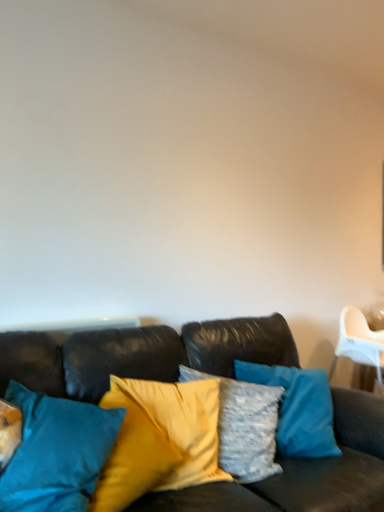
Question: Is silky yellow pillow at center, the 2th pillow when ordered from left to right, turned away from teal fabric pillow at center, marked as the 1th pillow in a left-to-right arrangement?

Choices:
 (A) yes
 (B) no

Answer: (B)

Question: Can you confirm if silky yellow pillow at center, the 2th pillow when ordered from left to right, is thinner than teal fabric pillow at center, marked as the 1th pillow in a left-to-right arrangement?

Choices:
 (A) no
 (B) yes

Answer: (B)

Question: Does silky yellow pillow at center, the 2th pillow when ordered from left to right, have a larger size compared to teal fabric pillow at center, the second pillow in the right-to-left sequence?

Choices:
 (A) yes
 (B) no

Answer: (B)

Question: From a real-world perspective, is silky yellow pillow at center, the 2th pillow when ordered from left to right, positioned under teal fabric pillow at center, the second pillow in the right-to-left sequence, based on gravity?

Choices:
 (A) yes
 (B) no

Answer: (A)

Question: Does silky yellow pillow at center, the 2th pillow when ordered from left to right, have a smaller size compared to teal fabric pillow at center, the second pillow in the right-to-left sequence?

Choices:
 (A) no
 (B) yes

Answer: (B)

Question: Can you confirm if silky yellow pillow at center, the first pillow when ordered from right to left, is positioned to the right of teal fabric pillow at center, the second pillow in the right-to-left sequence?

Choices:
 (A) yes
 (B) no

Answer: (A)

Question: From a real-world perspective, is leather couch at center below silky yellow pillow at center, the first pillow when ordered from right to left?

Choices:
 (A) no
 (B) yes

Answer: (B)

Question: Would you say leather couch at center is a long distance from silky yellow pillow at center, the 2th pillow when ordered from left to right?

Choices:
 (A) yes
 (B) no

Answer: (B)

Question: Is leather couch at center facing away from silky yellow pillow at center, the 2th pillow when ordered from left to right?

Choices:
 (A) no
 (B) yes

Answer: (B)

Question: Would you say leather couch at center contains silky yellow pillow at center, the first pillow when ordered from right to left?

Choices:
 (A) no
 (B) yes

Answer: (B)

Question: Is leather couch at center thinner than silky yellow pillow at center, the 2th pillow when ordered from left to right?

Choices:
 (A) no
 (B) yes

Answer: (A)

Question: Is leather couch at center bigger than silky yellow pillow at center, the 2th pillow when ordered from left to right?

Choices:
 (A) yes
 (B) no

Answer: (A)

Question: Considering the relative sizes of teal fabric pillow at center, the second pillow in the right-to-left sequence, and leather couch at center in the image provided, is teal fabric pillow at center, the second pillow in the right-to-left sequence, bigger than leather couch at center?

Choices:
 (A) no
 (B) yes

Answer: (A)